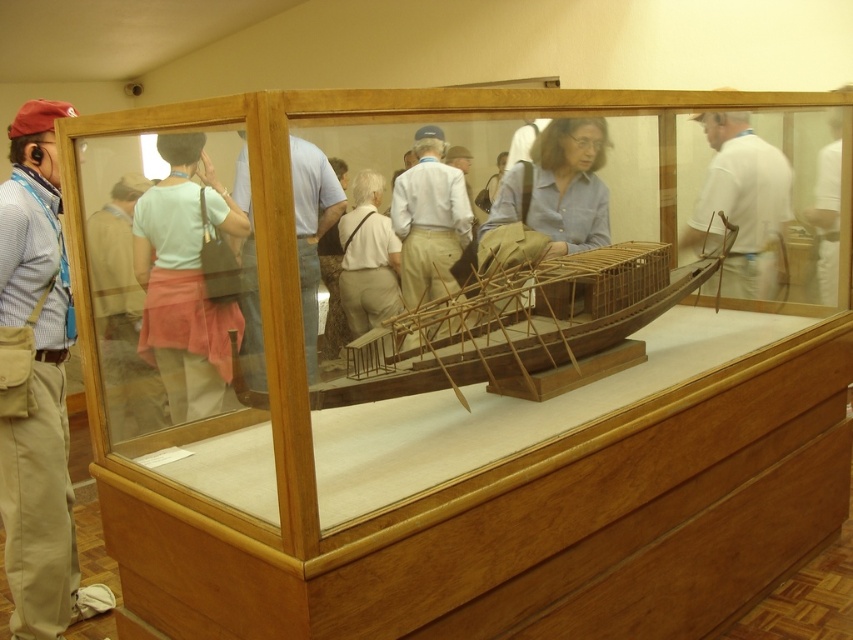
Question: Which point appears closest to the camera in this image?

Choices:
 (A) (770, 177)
 (B) (225, 326)
 (C) (56, 278)

Answer: (C)

Question: Does pink fabric skirt at center appear on the left side of white matte shirt at upper right?

Choices:
 (A) no
 (B) yes

Answer: (B)

Question: Is wooden boat at center positioned in front of white matte shirt at center?

Choices:
 (A) yes
 (B) no

Answer: (A)

Question: Can you confirm if pink fabric skirt at center is positioned to the right of white matte shirt at center?

Choices:
 (A) no
 (B) yes

Answer: (A)

Question: Which object is the closest to the pink fabric skirt at center?

Choices:
 (A) matte brown shirt at center
 (B) white matte shirt at center
 (C) light blue shirt at center

Answer: (C)

Question: Which object is positioned farthest from the white cotton shirt at center?

Choices:
 (A) light blue shirt at center
 (B) white matte shirt at center

Answer: (A)